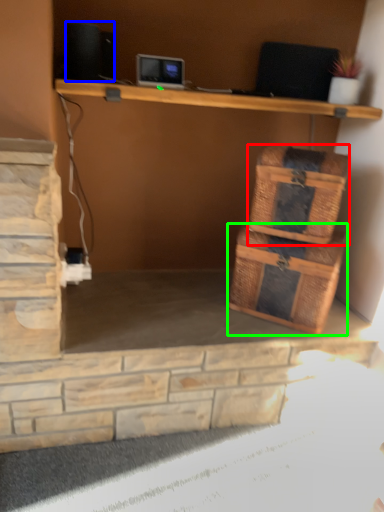
Question: Considering the real-world distances, which object is closest to basket (highlighted by a red box)? speaker (highlighted by a blue box) or storage box (highlighted by a green box).

Choices:
 (A) speaker
 (B) storage box

Answer: (B)